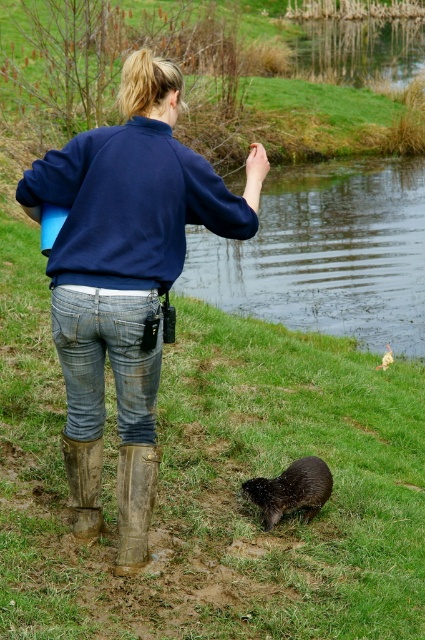
Does clear water at creek right have a smaller size compared to brown rubber boot at lower left?

Actually, clear water at creek right might be larger than brown rubber boot at lower left.

Locate an element on the screen. clear water at creek right is located at coordinates (x=325, y=253).

Between point (319, 488) and point (91, 497), which one is positioned in front?

Point (91, 497)

Is point (311, 502) closer to camera compared to point (70, 472)?

No, (311, 502) is behind (70, 472).

The height and width of the screenshot is (640, 425). Find the location of `shiny brown otter at lower center`. shiny brown otter at lower center is located at coordinates (291, 490).

Does brown rubber boot at lower left have a smaller size compared to shiny brown otter at lower center?

Yes.

Can you confirm if brown rubber boot at lower left is wider than shiny brown otter at lower center?

No.

Is point (150, 476) positioned in front of point (325, 483)?

Yes.

This screenshot has width=425, height=640. Find the location of `brown rubber boot at lower left`. brown rubber boot at lower left is located at coordinates (135, 502).